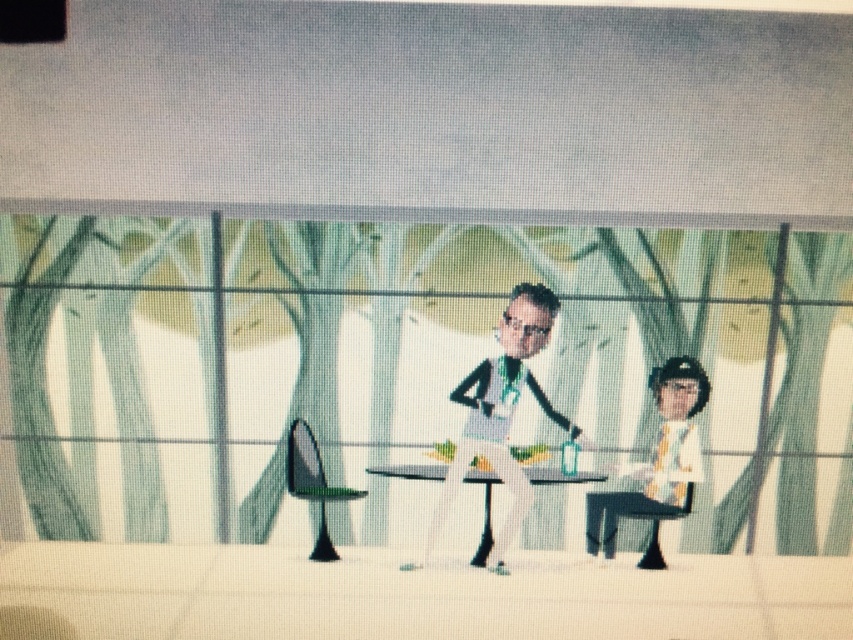
Question: Among these points, which one is nearest to the camera?

Choices:
 (A) (682, 500)
 (B) (409, 468)

Answer: (A)

Question: Considering the real-world distances, which object is farthest from the yellow tie at right?

Choices:
 (A) matte white suit at center
 (B) white glossy table at center

Answer: (A)

Question: Is matte white suit at center to the right of white glossy table at center from the viewer's perspective?

Choices:
 (A) yes
 (B) no

Answer: (A)

Question: Estimate the real-world distances between objects in this image. Which object is closer to the matte white suit at center?

Choices:
 (A) white glossy table at center
 (B) yellow tie at right

Answer: (A)

Question: Does matte white suit at center appear over white glossy table at center?

Choices:
 (A) no
 (B) yes

Answer: (B)

Question: Is matte white suit at center bigger than white glossy table at center?

Choices:
 (A) no
 (B) yes

Answer: (B)